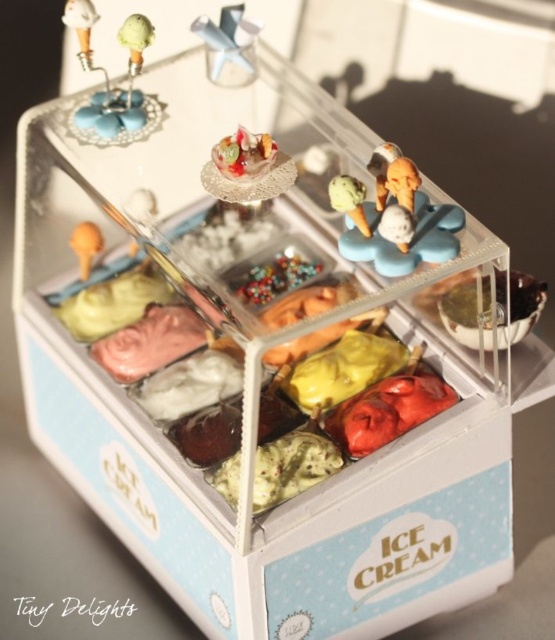
Does point (259, 138) lie behind point (78, 257)?

No, (259, 138) is in front of (78, 257).

Image resolution: width=555 pixels, height=640 pixels. What do you see at coordinates (244, 154) in the screenshot?
I see `translucent glass bowl at center` at bounding box center [244, 154].

Is point (259, 154) positioned after point (69, 241)?

No.

The image size is (555, 640). I want to click on translucent glass bowl at center, so click(x=244, y=154).

Between white glossy ice cream cone at upper left and matte orange ice cream scoop at center, which one is positioned higher?

white glossy ice cream cone at upper left is higher up.

In the scene shown: Does white glossy ice cream cone at upper left have a smaller size compared to matte orange ice cream scoop at center?

No.

Is point (74, 17) positioned in front of point (89, 237)?

That is True.

In order to click on white glossy ice cream cone at upper left in this screenshot , I will do `click(82, 28)`.

Can you confirm if metallic silver spoon at upper center is wider than matte orange ice cream scoop at center?

Correct, the width of metallic silver spoon at upper center exceeds that of matte orange ice cream scoop at center.

What do you see at coordinates (229, 45) in the screenshot? This screenshot has width=555, height=640. I see `metallic silver spoon at upper center` at bounding box center [229, 45].

Locate an element on the screen. Image resolution: width=555 pixels, height=640 pixels. metallic silver spoon at upper center is located at coordinates (229, 45).